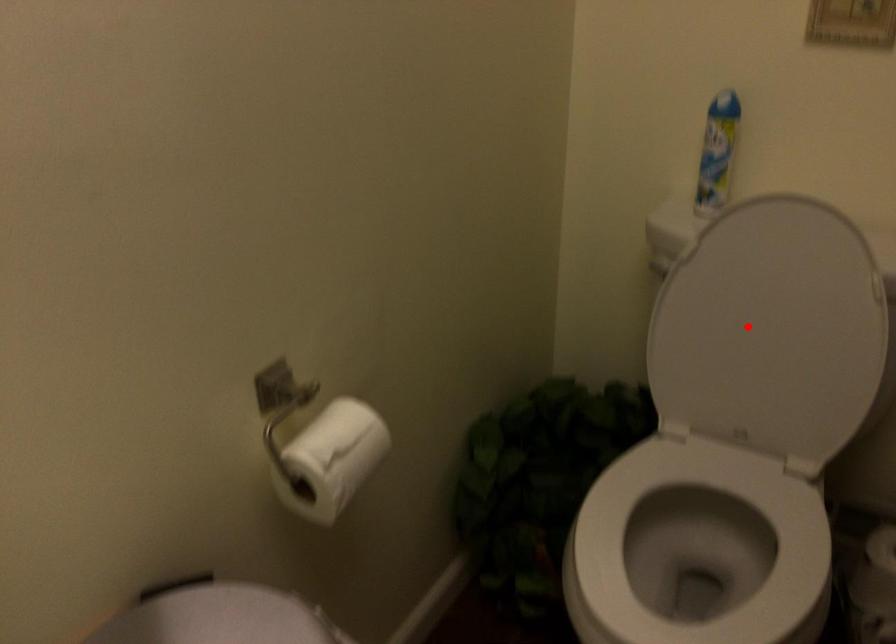
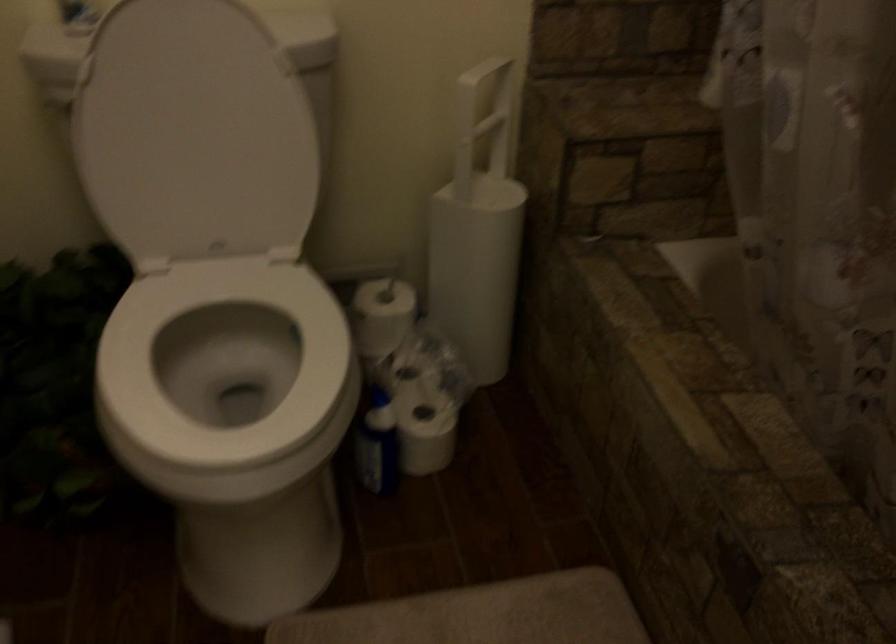
Find the pixel in the second image that matches the highlighted location in the first image.

(194, 134)